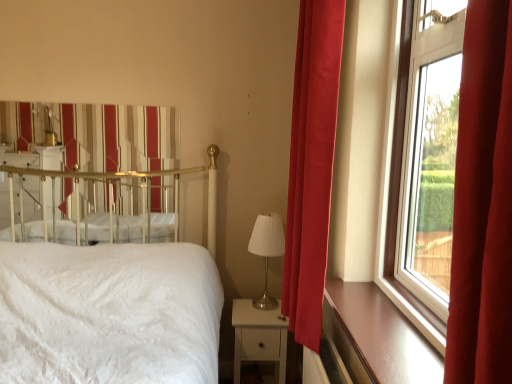
Identify the location of free space above metallic gold canopy bed at upper left (from a real-world perspective). This screenshot has height=384, width=512. (83, 102).